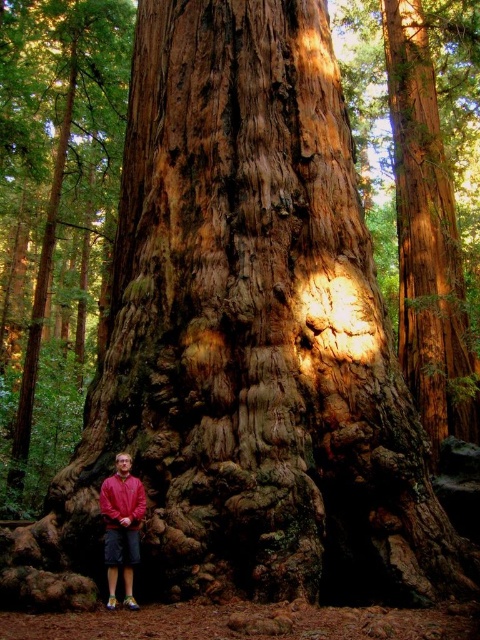
Consider the image. Is rough bark tree at lower left above red matte jacket at lower left?

Yes, rough bark tree at lower left is above red matte jacket at lower left.

What are the coordinates of `rough bark tree at lower left` in the screenshot? It's located at (55, 221).

Where is `rough bark tree at lower left`? rough bark tree at lower left is located at coordinates (55, 221).

Where is `rough bark tree at lower left`? The width and height of the screenshot is (480, 640). rough bark tree at lower left is located at coordinates (55, 221).

How far apart are rough bark tree at lower left and red matte sweatshirt at lower left?

rough bark tree at lower left is 10.13 meters from red matte sweatshirt at lower left.

Is point (15, 435) farther from viewer compared to point (119, 477)?

Yes, it is.

Who is more forward, (64, 300) or (133, 524)?

Point (133, 524) is more forward.

Locate an element on the screen. The image size is (480, 640). rough bark tree at lower left is located at coordinates click(x=55, y=221).

Can you confirm if red matte jacket at lower left is positioned above red matte sweatshirt at lower left?

Incorrect, red matte jacket at lower left is not positioned above red matte sweatshirt at lower left.

Can you confirm if red matte jacket at lower left is positioned below red matte sweatshirt at lower left?

Yes, red matte jacket at lower left is below red matte sweatshirt at lower left.

Who is more forward, [129,472] or [120,525]?

Positioned in front is point [120,525].

The height and width of the screenshot is (640, 480). I want to click on red matte jacket at lower left, so click(121, 525).